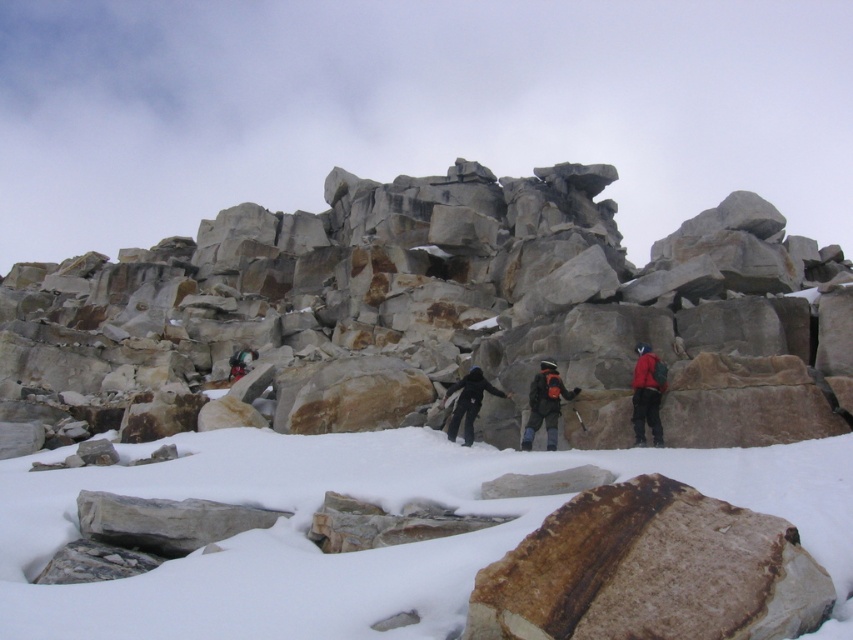
This screenshot has width=853, height=640. What do you see at coordinates (442, 316) in the screenshot?
I see `rustic stone boulders at center` at bounding box center [442, 316].

Does point (779, 268) come in front of point (323, 570)?

No, (779, 268) is behind (323, 570).

Who is more distant from viewer, (129, 401) or (833, 497)?

The point (129, 401) is more distant.

Find the location of a particular element. rustic stone boulders at center is located at coordinates (442, 316).

Can you confirm if red fabric jacket at center is positioned to the right of matte black jacket at center?

Indeed, red fabric jacket at center is positioned on the right side of matte black jacket at center.

Does red fabric jacket at center have a larger size compared to matte black jacket at center?

Actually, red fabric jacket at center might be smaller than matte black jacket at center.

At what (x,y) coordinates should I click in order to perform the action: click on red fabric jacket at center. Please return your answer as a coordinate pair (x, y). Looking at the image, I should click on (x=647, y=396).

This screenshot has height=640, width=853. I want to click on red fabric jacket at center, so click(x=647, y=396).

Is point (538, 380) positioned behind point (451, 413)?

That is False.

Which is more to the left, matte black jacket at center or black fabric jacket at center?

black fabric jacket at center is more to the left.

Identify the location of matte black jacket at center. Image resolution: width=853 pixels, height=640 pixels. (544, 404).

Image resolution: width=853 pixels, height=640 pixels. I want to click on matte black jacket at center, so [x=544, y=404].